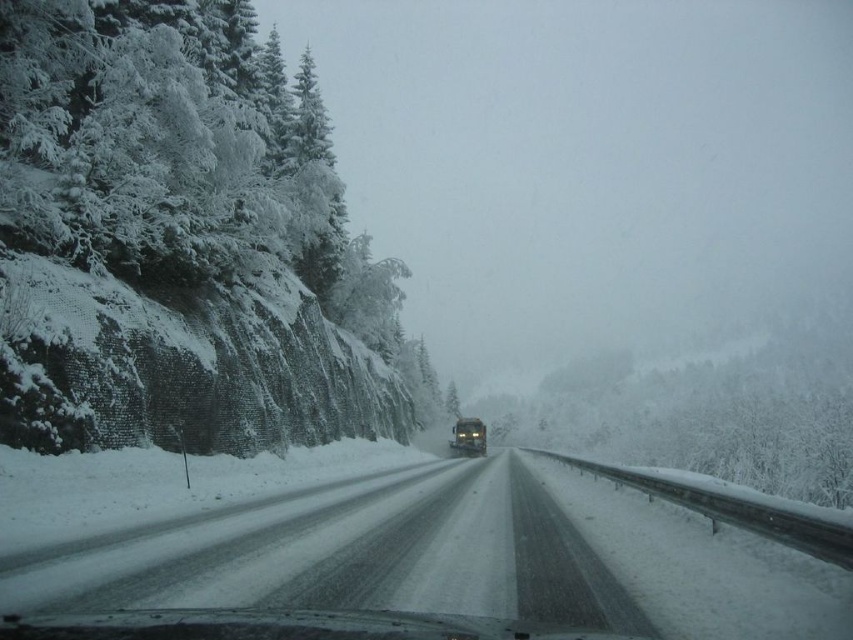
Question: From the image, what is the correct spatial relationship of snowy asphalt road at center in relation to matte black bus at center?

Choices:
 (A) above
 (B) below

Answer: (A)

Question: Among these objects, which one is farthest from the camera?

Choices:
 (A) snowy asphalt road at center
 (B) white frosty trees at left

Answer: (B)

Question: From the image, what is the correct spatial relationship of white frosty trees at left in relation to matte black bus at center?

Choices:
 (A) left
 (B) right

Answer: (A)

Question: Which of these objects is positioned farthest from the snowy asphalt road at center?

Choices:
 (A) matte black bus at center
 (B) white frosty trees at left

Answer: (A)

Question: Can you confirm if white frosty trees at left is thinner than snowy asphalt road at center?

Choices:
 (A) yes
 (B) no

Answer: (A)

Question: Which object is farther from the camera taking this photo?

Choices:
 (A) white frosty trees at left
 (B) matte black bus at center
 (C) snowy asphalt road at center

Answer: (B)